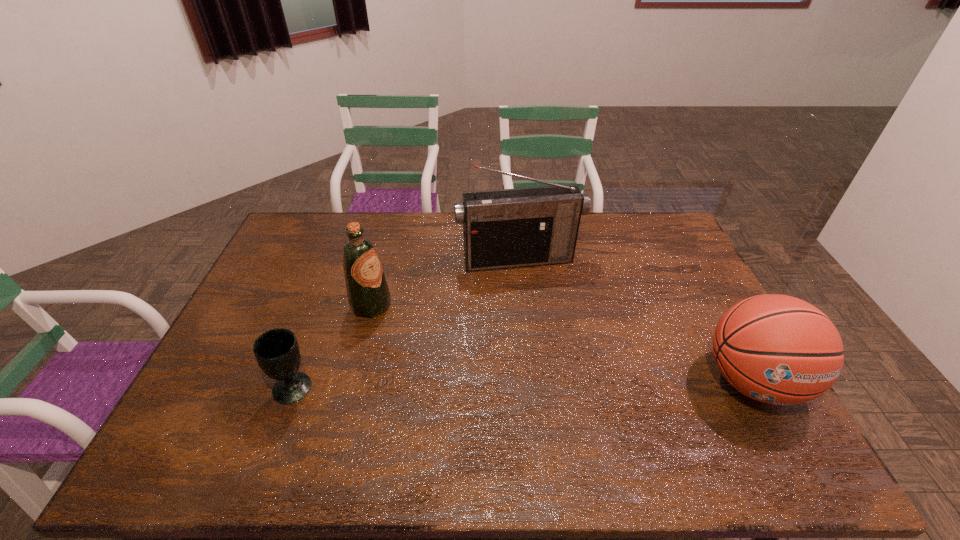
Find the location of a particular element. The height and width of the screenshot is (540, 960). vacant space at the near edge of the desktop is located at coordinates (506, 403).

Identify the location of blank space at the left edge of the desktop. This screenshot has width=960, height=540. tap(303, 288).

The width and height of the screenshot is (960, 540). In order to click on free space at the right edge of the desktop in this screenshot , I will do `click(697, 302)`.

In the image, there is a desktop. At what (x,y) coordinates should I click in order to perform the action: click on vacant space at the far right corner. Please return your answer as a coordinate pair (x, y). Looking at the image, I should click on (x=660, y=213).

You are a GUI agent. You are given a task and a screenshot of the screen. Output one action in this format:
    pyautogui.click(x=<x>, y=<y>)
    Task: Click on the free space between the second farthest object and the tallest object
    The image size is (960, 540).
    Given the screenshot: What is the action you would take?
    pyautogui.click(x=444, y=282)

I want to click on vacant region between the second farthest object and the chalice, so click(x=332, y=347).

Locate an element on the screen. Image resolution: width=960 pixels, height=540 pixels. vacant area between the third object from right to left and the leftmost object is located at coordinates (332, 347).

Locate an element on the screen. The width and height of the screenshot is (960, 540). free point between the leftmost object and the second farthest object is located at coordinates (332, 347).

The image size is (960, 540). In order to click on unoccupied area between the olive oil and the rightmost object in this screenshot , I will do `click(562, 343)`.

Where is `empty location between the basketball and the leftmost object`? empty location between the basketball and the leftmost object is located at coordinates (523, 384).